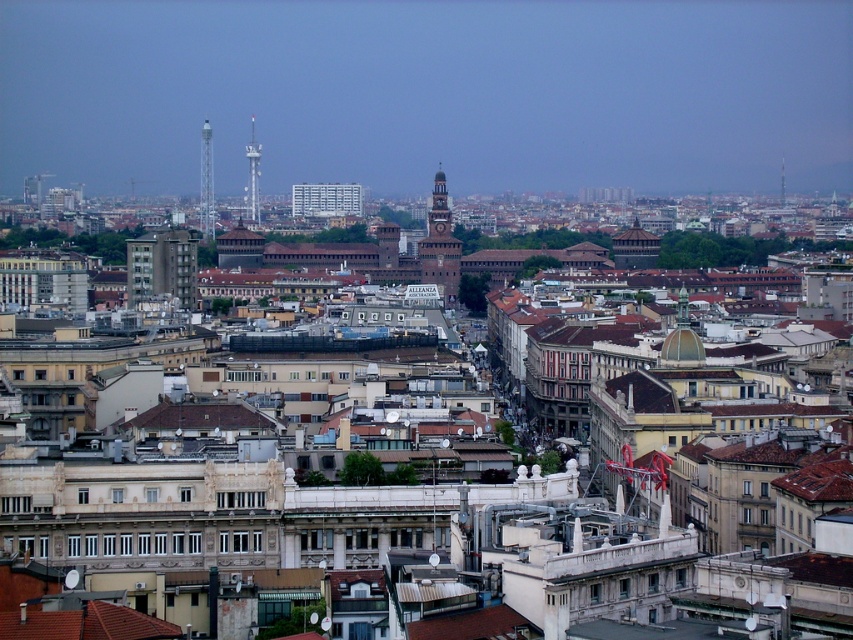
Is point (444, 227) in front of point (201, 140)?

That is True.

Does brick tower at center have a greater height compared to metallic silver tower at upper left?

No.

What do you see at coordinates (439, 232) in the screenshot? I see `brick tower at center` at bounding box center [439, 232].

Find the location of `brick tower at center`. brick tower at center is located at coordinates (439, 232).

Between metallic silver tower at upper left and metallic tower at left, which one appears on the left side from the viewer's perspective?

metallic silver tower at upper left

Is metallic silver tower at upper left shorter than metallic tower at left?

No.

Is point (202, 225) positioned in front of point (251, 129)?

Yes, it is.

Where is `metallic silver tower at upper left`? The image size is (853, 640). metallic silver tower at upper left is located at coordinates (206, 184).

Is brick tower at center positioned at the back of metallic tower at left?

No.

Is brick tower at center wider than metallic tower at left?

Yes, brick tower at center is wider than metallic tower at left.

Identify the location of brick tower at center. This screenshot has height=640, width=853. (439, 232).